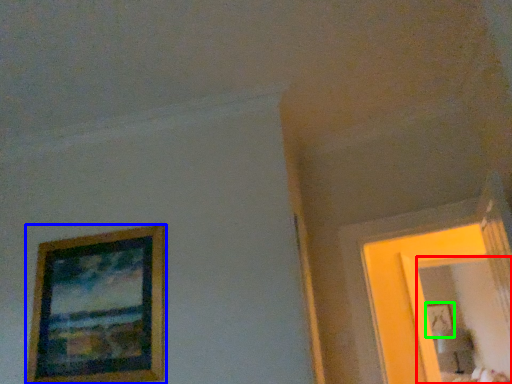
Question: Which object is positioned closest to mirror (highlighted by a red box)? Select from picture frame (highlighted by a blue box) and picture frame (highlighted by a green box).

Choices:
 (A) picture frame
 (B) picture frame

Answer: (B)